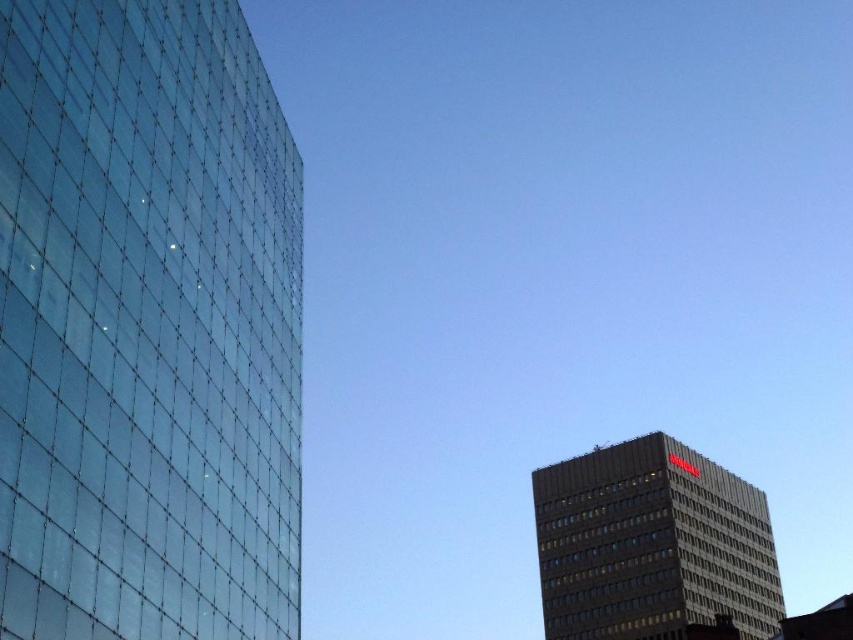
You are standing at the point marked as point (146, 324) in the cityscape. Which building are you facing? The transparent glass building at left or the beige traditional building at right?

The point (146, 324) is on the transparent glass building at left, so you are facing the transparent glass building at left.

You are standing in the city and see the point at coordinates point (189, 32). If you want to throw a ball to hit that point, and your throwing range is 30 meters, will you be able to reach it?

The distance between you and point (189, 32) is 32.79 meters, which exceeds your throwing range of 30 meters. Therefore, you cannot reach it.

Based on the photo, you are standing at the base of the modern glass skyscraper on the left and want to look at the point labeled point (9, 145) and point (543, 627). Which point is closer to you?

Point (9, 145) is in front of point (543, 627), so it is closer to you.